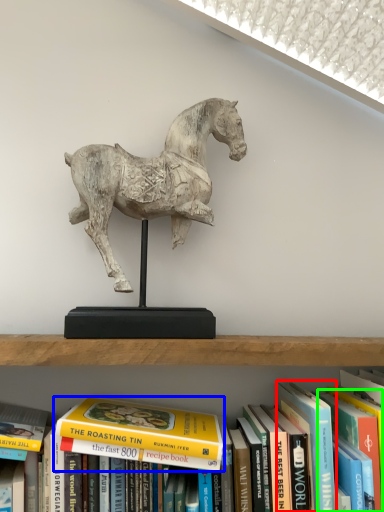
Question: Estimate the real-world distances between objects in this image. Which object is farther from paperback book (highlighted by a red box), book (highlighted by a blue box) or paperback book (highlighted by a green box)?

Choices:
 (A) book
 (B) paperback book

Answer: (A)